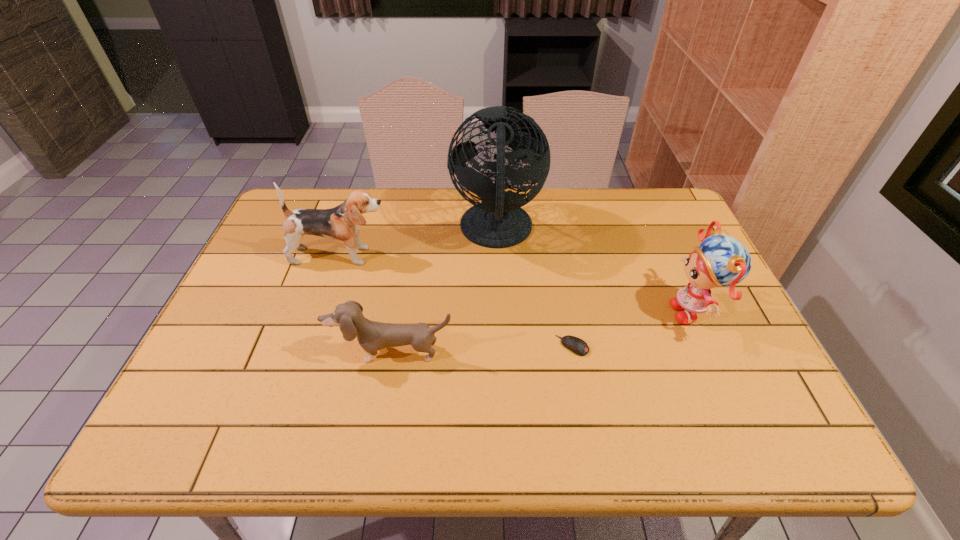
Image resolution: width=960 pixels, height=540 pixels. I want to click on free space at the left edge, so click(x=244, y=361).

Identify the location of vacant position at the right edge of the desktop. (674, 261).

At what (x,y) coordinates should I click in order to perform the action: click on vacant area that lies between the rightmost object and the computer mouse. Please return your answer as a coordinate pair (x, y). Looking at the image, I should click on (633, 329).

At what (x,y) coordinates should I click in order to perform the action: click on free space between the taller puppy and the doll. Please return your answer as a coordinate pair (x, y). The width and height of the screenshot is (960, 540). Looking at the image, I should click on (517, 284).

This screenshot has height=540, width=960. Identify the location of vacant area that lies between the rightmost object and the fourth tallest object. (542, 332).

Identify the location of free space between the farther puppy and the fourth tallest object. Image resolution: width=960 pixels, height=540 pixels. (367, 305).

Identify the location of free spot between the computer mouse and the rightmost object. (633, 329).

The height and width of the screenshot is (540, 960). Find the location of `vacant region between the farther puppy and the tallest object`. vacant region between the farther puppy and the tallest object is located at coordinates (419, 244).

At what (x,y) coordinates should I click in order to perform the action: click on vacant region between the computer mouse and the shorter puppy. Please return your answer as a coordinate pair (x, y). The image size is (960, 540). Looking at the image, I should click on (482, 349).

Identify the location of free space between the farther puppy and the computer mouse. The width and height of the screenshot is (960, 540). (457, 301).